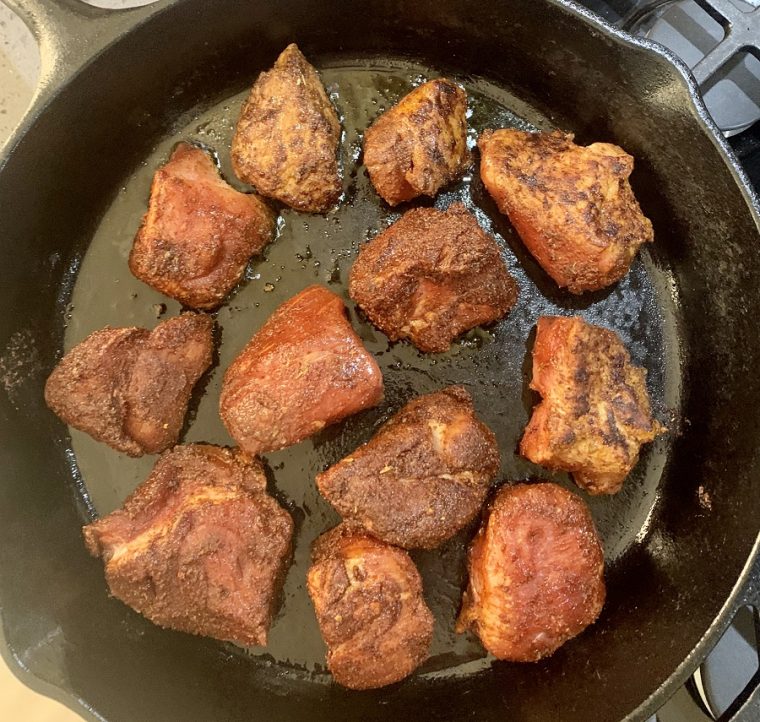
Where is `edge of pan`? edge of pan is located at coordinates (112, 112).